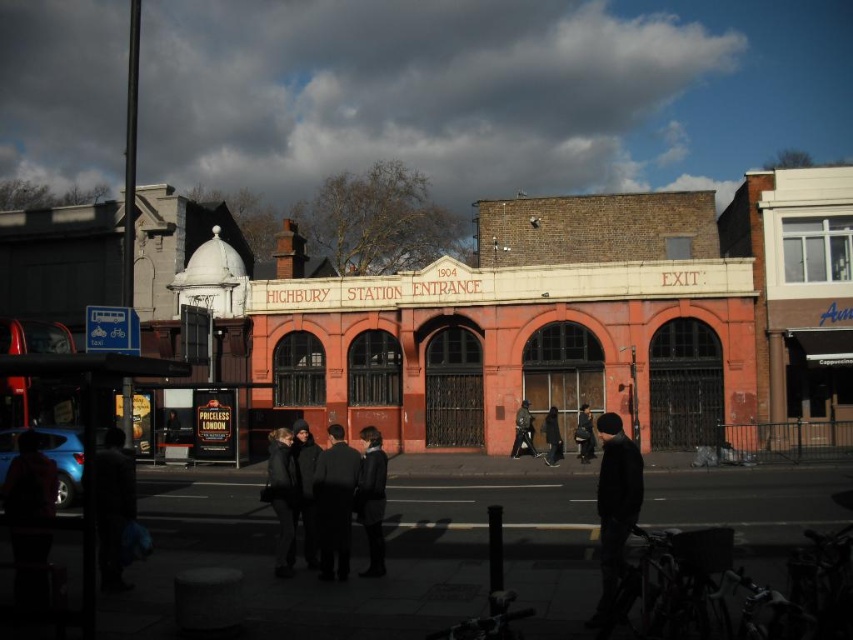
From the picture: You are standing at the Highbury Station Entrance and want to move towards the point labeled point (94, 388). Is this point located in front of or behind the point labeled point (619, 460) from your current position?

Point (94, 388) is in front of point (619, 460), so the point you want to move towards is located in front of the other point.